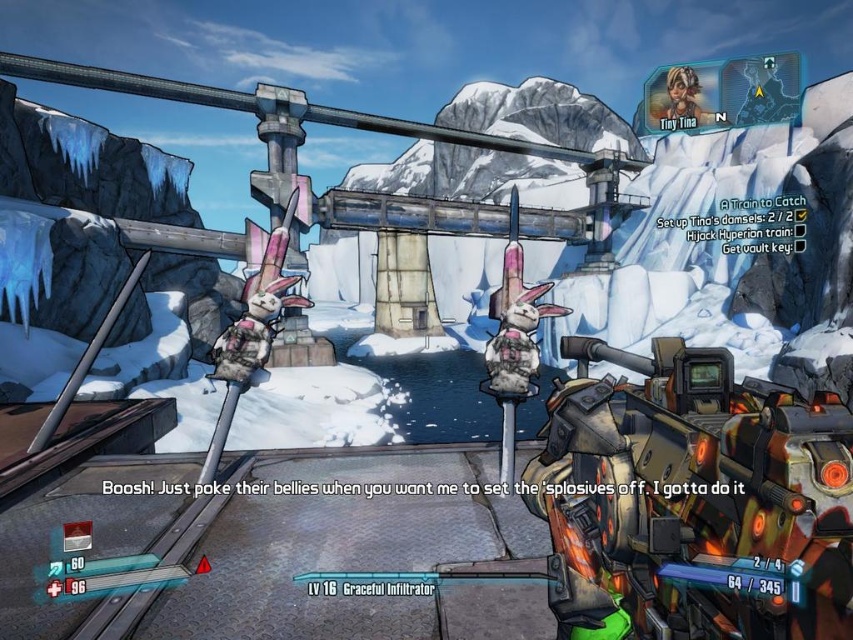
Question: Does orange metallic robot at right appear on the right side of metallic helmet at upper center?

Choices:
 (A) no
 (B) yes

Answer: (A)

Question: Which of the following is the closest to the observer?

Choices:
 (A) (x=573, y=465)
 (B) (x=764, y=74)

Answer: (A)

Question: Considering the relative positions of orange metallic robot at right and metallic helmet at upper center in the image provided, where is orange metallic robot at right located with respect to metallic helmet at upper center?

Choices:
 (A) above
 (B) below

Answer: (B)

Question: Can you confirm if orange metallic robot at right is positioned below metallic helmet at upper center?

Choices:
 (A) no
 (B) yes

Answer: (B)